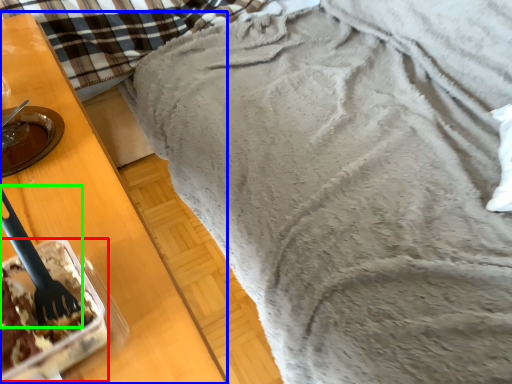
Question: Which object is the farthest from dessert (highlighted by a red box)? Choose among these: furniture (highlighted by a blue box) or silverware (highlighted by a green box).

Choices:
 (A) furniture
 (B) silverware

Answer: (A)